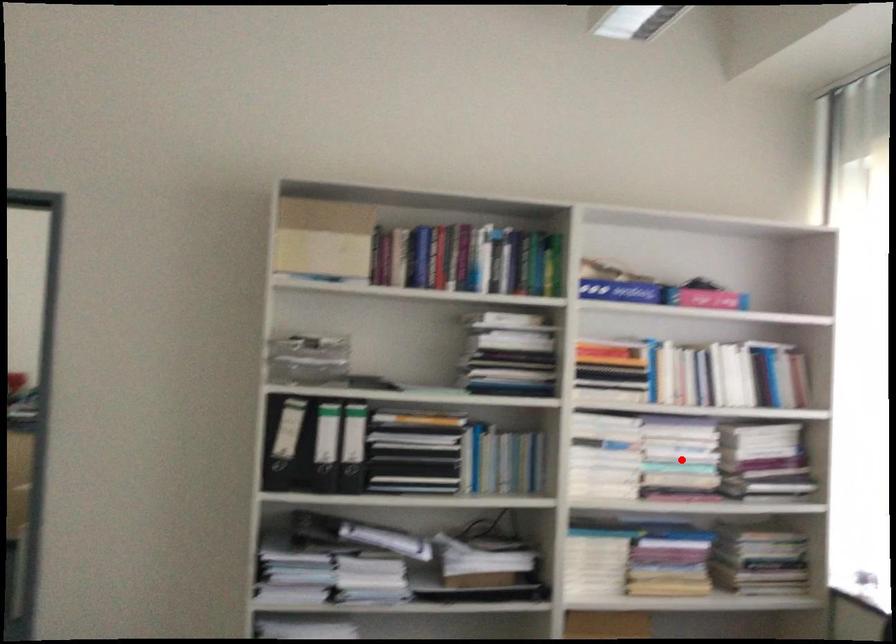
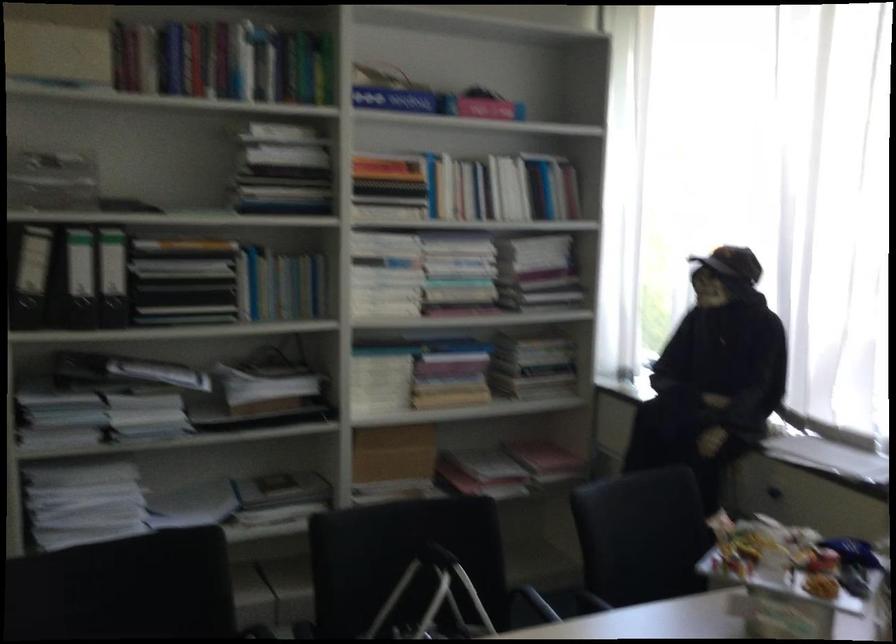
Find the pixel in the second image that matches the highlighted location in the first image.

(459, 272)